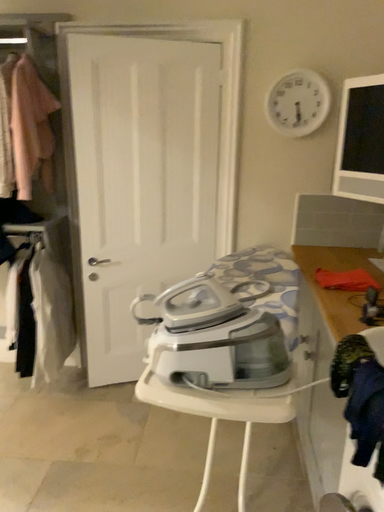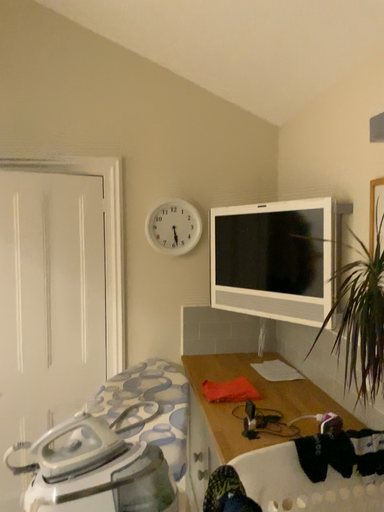
Question: How did the camera likely rotate when shooting the video?

Choices:
 (A) rotated upward
 (B) rotated downward

Answer: (A)